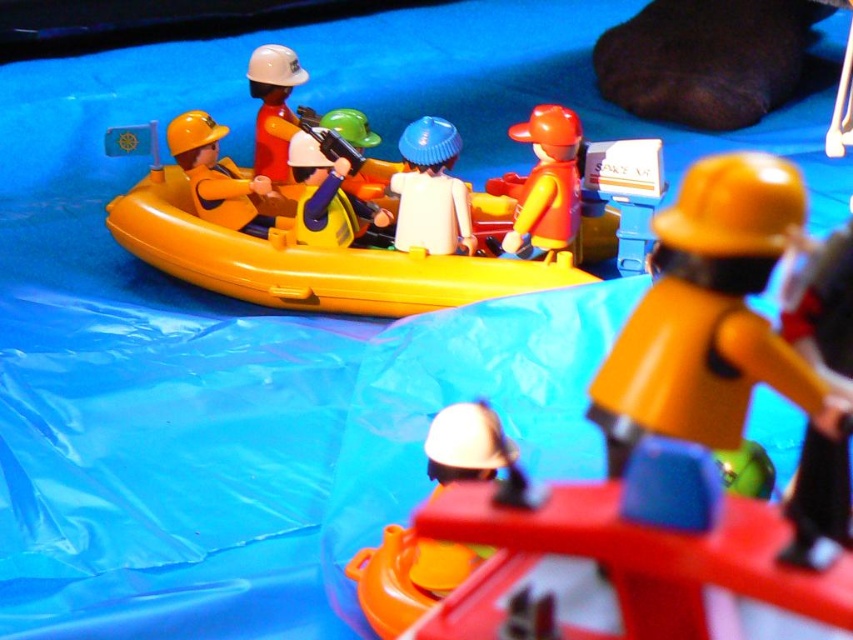
Is white matte helmet at lower center to the left of white matte figure at center from the viewer's perspective?

No, white matte helmet at lower center is not to the left of white matte figure at center.

Between white matte helmet at lower center and white matte figure at center, which one is positioned higher?

white matte figure at center is higher up.

Identify the location of white matte helmet at lower center. The image size is (853, 640). pos(408,577).

Does white matte helmet at lower center have a larger size compared to matte white helmet at upper center?

Yes, white matte helmet at lower center is bigger than matte white helmet at upper center.

Who is taller, white matte helmet at lower center or matte white helmet at upper center?

Standing taller between the two is matte white helmet at upper center.

The width and height of the screenshot is (853, 640). Describe the element at coordinates (408, 577) in the screenshot. I see `white matte helmet at lower center` at that location.

The width and height of the screenshot is (853, 640). Identify the location of white matte helmet at lower center. (408, 577).

How far apart are yellow rubber boat at center and matte yellow helmet at center?

yellow rubber boat at center and matte yellow helmet at center are 34.53 inches apart.

Does yellow rubber boat at center appear over matte yellow helmet at center?

Correct, yellow rubber boat at center is located above matte yellow helmet at center.

Is point (595, 211) farther from viewer compared to point (786, 388)?

Yes, point (595, 211) is farther from viewer.

Identify the location of yellow rubber boat at center. The height and width of the screenshot is (640, 853). (396, 225).